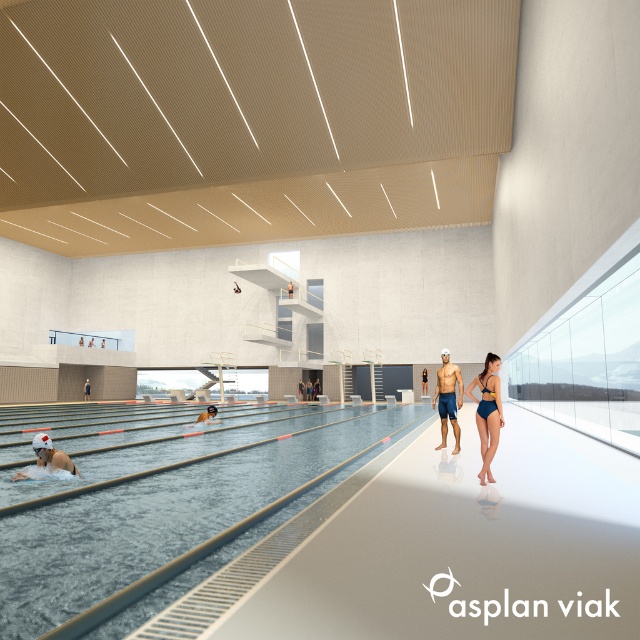
Which is behind, point (308, 388) or point (84, 397)?

Positioned behind is point (308, 388).

How much distance is there between matte blue swimsuit at center and blue fabric swimmer at center?

A distance of 18.57 meters exists between matte blue swimsuit at center and blue fabric swimmer at center.

The width and height of the screenshot is (640, 640). Describe the element at coordinates (308, 387) in the screenshot. I see `matte blue swimsuit at center` at that location.

Where is `matte blue swimsuit at center`? matte blue swimsuit at center is located at coordinates (308, 387).

Is blue matte swimsuit at center smaller than blue fabric swimmer at center?

No.

Between blue matte swimsuit at center and blue fabric swimmer at center, which one is positioned higher?

blue matte swimsuit at center is higher up.

Between point (481, 442) and point (84, 380), which one is positioned behind?

The point (84, 380) is behind.

Find the location of a particular element. This screenshot has height=640, width=640. blue matte swimsuit at center is located at coordinates (486, 412).

Is matte blue swim trunks at center positioned behind blue fabric swimmer at center?

No, it is in front of blue fabric swimmer at center.

Is point (449, 378) positioned in front of point (83, 385)?

Yes, it is.

Image resolution: width=640 pixels, height=640 pixels. I want to click on matte blue swim trunks at center, so click(x=448, y=397).